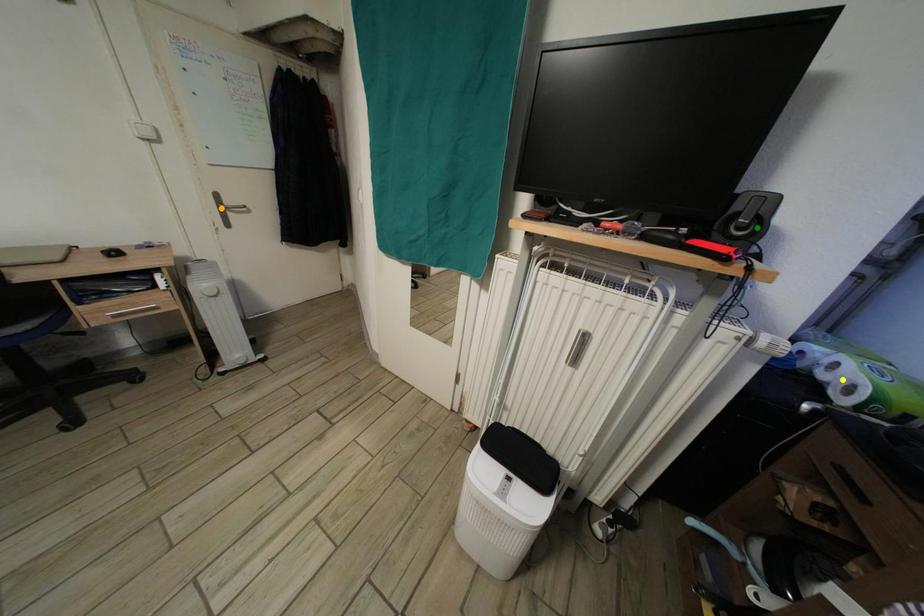
Order these from nearest to farthest:
A) orange point
B) green point
C) yellow point

1. green point
2. yellow point
3. orange point